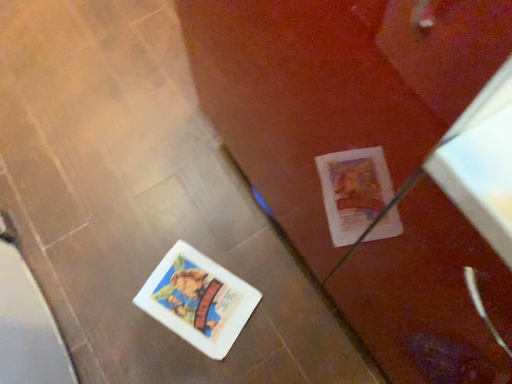
I want to click on empty space that is ontop of white glossy magazine at lower left (from a real-world perspective), so click(x=196, y=302).